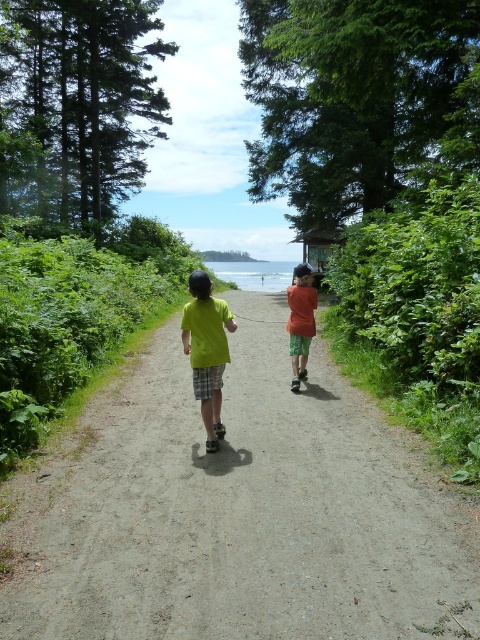
You are standing at a point equidistant from both the point at [204,604] and the point at [190,312]. If you want to reach the closer point to the viewer first, which point should you head towards?

You should head towards point [204,604] because it is closer to the viewer than point [190,312].

You are standing at the point marked by the coordinates point (241, 513). Looking around, you see two children walking along a sandy path bordered by lush greenery. Which direction should you walk to reach the dirt path at center?

The dirt path at center is exactly at the point you are currently standing, so you are already on the dirt path at center.

You are a parent trying to guide your children along the dirt path at center while ensuring they stay within the path. Given that the orange cotton shirt at center is part of one of the children, can you determine if the path is wide enough for both children to walk side by side without stepping off the path?

The dirt path at center is wider than the orange cotton shirt at center. Since the orange cotton shirt at center belongs to one of the children, the path is wide enough for both children to walk side by side without stepping off the path.